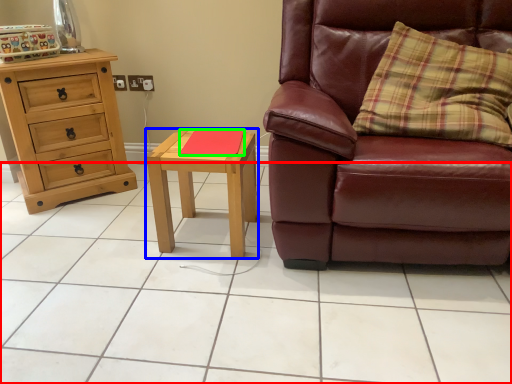
Question: Which is farther away from ceramic tile (highlighted by a red box)? nightstand (highlighted by a blue box) or pad (highlighted by a green box)?

Choices:
 (A) nightstand
 (B) pad

Answer: (B)